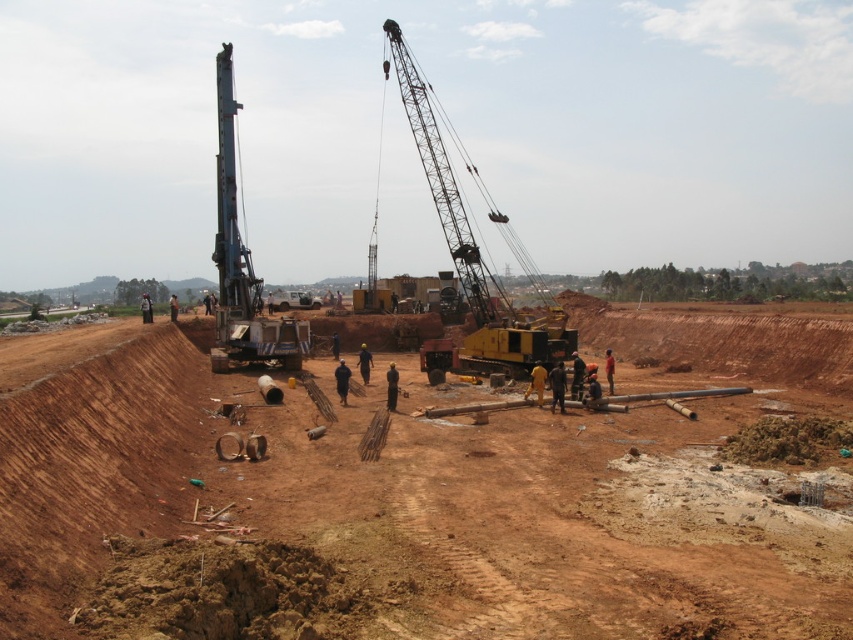
Who is more forward, (415, 97) or (271, 353)?

Point (271, 353)

Based on the photo, does metallic yellow crane at center have a greater width compared to metallic gray drilling rig at left?

No, metallic yellow crane at center is not wider than metallic gray drilling rig at left.

Which is behind, point (492, 368) or point (216, 330)?

The point (216, 330) is behind.

Find the location of a particular element. metallic yellow crane at center is located at coordinates (473, 253).

Does brown dirt at lower left have a lesser width compared to metallic yellow crane at center?

Incorrect, brown dirt at lower left's width is not less than metallic yellow crane at center's.

Is brown dirt at lower left above metallic yellow crane at center?

No.

Measure the distance between point (105, 547) and camera.

Point (105, 547) and camera are 11.93 meters apart from each other.

Locate an element on the screen. The image size is (853, 640). brown dirt at lower left is located at coordinates (428, 490).

Does brown dirt at lower left lie in front of metallic gray drilling rig at left?

Yes, brown dirt at lower left is in front of metallic gray drilling rig at left.

Is brown dirt at lower left bigger than metallic gray drilling rig at left?

No, brown dirt at lower left is not bigger than metallic gray drilling rig at left.

Where is `brown dirt at lower left`? brown dirt at lower left is located at coordinates (428, 490).